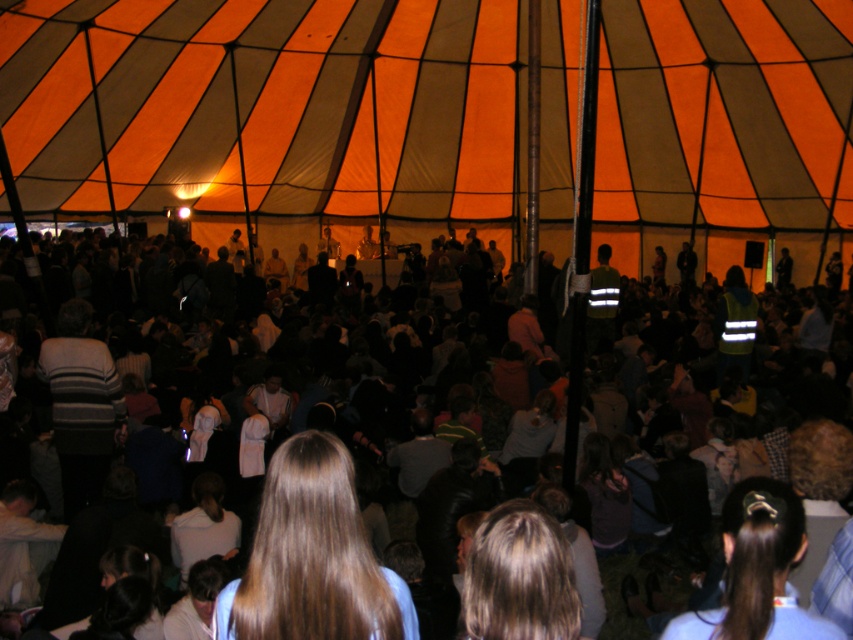
Can you confirm if orange striped tent at center is bigger than dark clothing crowd at center?

No.

Can you confirm if orange striped tent at center is positioned above dark clothing crowd at center?

Correct, orange striped tent at center is located above dark clothing crowd at center.

Is point (142, 138) farther from camera compared to point (799, 396)?

Yes.

Find the location of `orange striped tent at center`. orange striped tent at center is located at coordinates (268, 106).

Between dark clothing crowd at center and brown hair at center, which one has less height?

brown hair at center

Can you confirm if dark clothing crowd at center is positioned to the left of brown hair at center?

Indeed, dark clothing crowd at center is positioned on the left side of brown hair at center.

Which is behind, point (384, 355) or point (228, 600)?

Positioned behind is point (384, 355).

Where is `dark clothing crowd at center`? dark clothing crowd at center is located at coordinates (718, 387).

Is orange striped tent at center taller than brown hair at center?

Yes.

Can you confirm if orange striped tent at center is smaller than brown hair at center?

No, orange striped tent at center is not smaller than brown hair at center.

Between point (503, 72) and point (318, 573), which one is positioned behind?

Point (503, 72)

Where is `orange striped tent at center`? The width and height of the screenshot is (853, 640). orange striped tent at center is located at coordinates (268, 106).